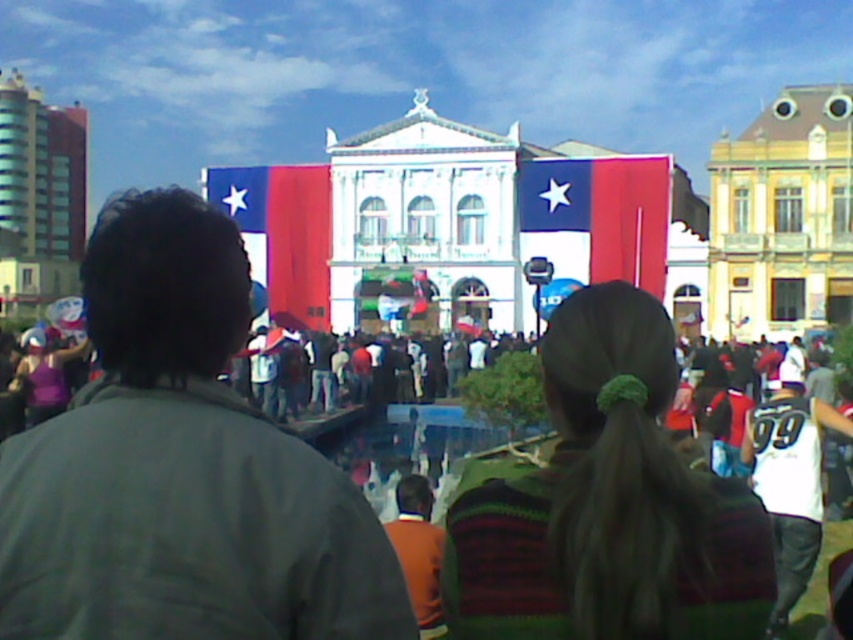
You are standing in the crowd at the event and want to take a photo of the matte red flag at center without any people blocking it. Based on the scene description, where should you position yourself relative to the crowd to ensure the flag is visible?

The matte red flag at center is located at coordinates [602,211]. To avoid people blocking the flag, position yourself in an area of the crowd where there are fewer individuals, such as towards the edges or behind taller spectators, ensuring your line of sight aligns with the flag at those coordinates.

You are organizing an outdoor event and need to ensure that the green knitted sweater at center and the matte fabric flag at center do not block the view of the building behind them. Based on their sizes, which object is more likely to obstruct the view?

The green knitted sweater at center might be wider than matte fabric flag at center, so it is more likely to obstruct the view of the building behind them.